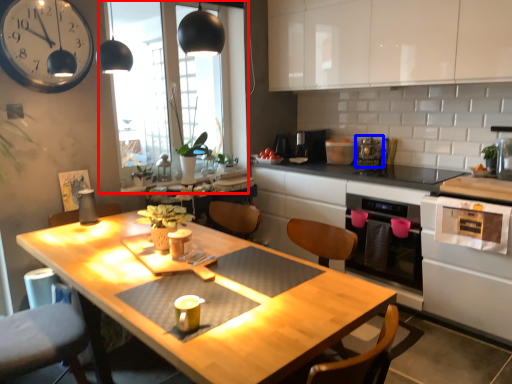
Question: Which of the following is the closest to the observer, window (highlighted by a red box) or appliance (highlighted by a blue box)?

Choices:
 (A) window
 (B) appliance

Answer: (A)